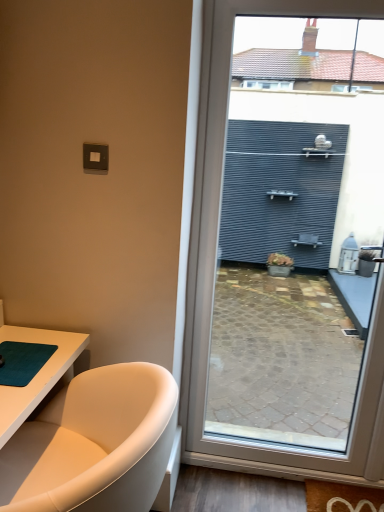
At what (x,y) coordinates should I click in order to perform the action: click on matte gray wall at right. Please return your answer as a coordinate pair (x, y). Image resolution: width=384 pixels, height=512 pixels. Looking at the image, I should click on (214, 272).

Which is in front, white leather bathtub at lower left or teal matte yoga mat at lower left?

white leather bathtub at lower left is closer to the camera.

Does white leather bathtub at lower left appear on the left side of teal matte yoga mat at lower left?

No.

Are white leather bathtub at lower left and teal matte yoga mat at lower left located far from each other?

No.

Can we say white leather bathtub at lower left lies outside teal matte yoga mat at lower left?

white leather bathtub at lower left lies outside teal matte yoga mat at lower left's area.

Based on the photo, does matte gray wall at right come behind teal matte yoga mat at lower left?

Yes, matte gray wall at right is further from the camera.

Is matte gray wall at right wider than teal matte yoga mat at lower left?

No, matte gray wall at right is not wider than teal matte yoga mat at lower left.

Based on their sizes in the image, would you say matte gray wall at right is bigger or smaller than teal matte yoga mat at lower left?

Considering their sizes, matte gray wall at right takes up more space than teal matte yoga mat at lower left.

In the scene shown: From the image's perspective, is teal matte yoga mat at lower left above white leather bathtub at lower left?

Yes, from the image's perspective, teal matte yoga mat at lower left is on top of white leather bathtub at lower left.

Is the surface of teal matte yoga mat at lower left in direct contact with white leather bathtub at lower left?

No, teal matte yoga mat at lower left is not in contact with white leather bathtub at lower left.

In terms of size, does teal matte yoga mat at lower left appear bigger or smaller than white leather bathtub at lower left?

teal matte yoga mat at lower left is smaller than white leather bathtub at lower left.

Can you tell me how much teal matte yoga mat at lower left and white leather bathtub at lower left differ in facing direction?

The angle between the facing direction of teal matte yoga mat at lower left and the facing direction of white leather bathtub at lower left is 176 degrees.

Is matte gray wall at right at the back of teal matte yoga mat at lower left?

No, matte gray wall at right is not at the back of teal matte yoga mat at lower left.

Do you think teal matte yoga mat at lower left is within matte gray wall at right, or outside of it?

teal matte yoga mat at lower left is spatially situated outside matte gray wall at right.

Considering the sizes of objects teal matte yoga mat at lower left and matte gray wall at right in the image provided, who is shorter, teal matte yoga mat at lower left or matte gray wall at right?

Standing shorter between the two is teal matte yoga mat at lower left.

Based on their sizes in the image, would you say teal matte yoga mat at lower left is bigger or smaller than matte gray wall at right?

In the image, teal matte yoga mat at lower left appears to be smaller than matte gray wall at right.

From the image's perspective, relative to matte gray wall at right, is white leather bathtub at lower left above or below?

Clearly, from the image's perspective, white leather bathtub at lower left is below matte gray wall at right.

Is white leather bathtub at lower left bigger than matte gray wall at right?

Indeed, white leather bathtub at lower left has a larger size compared to matte gray wall at right.

Which of these two, white leather bathtub at lower left or matte gray wall at right, stands taller?

With more height is matte gray wall at right.

Can you confirm if matte gray wall at right is wider than white leather bathtub at lower left?

Incorrect, the width of matte gray wall at right does not surpass that of white leather bathtub at lower left.

From a real-world perspective, is matte gray wall at right under white leather bathtub at lower left?

Actually, matte gray wall at right is physically above white leather bathtub at lower left in the real world.

Which is more to the right, matte gray wall at right or white leather bathtub at lower left?

matte gray wall at right is more to the right.

Find the location of a particular element. The width and height of the screenshot is (384, 512). yoga mat above the white leather bathtub at lower left (from the image's perspective) is located at coordinates (22, 361).

Locate an element on the screen. Image resolution: width=384 pixels, height=512 pixels. yoga mat that appears below the matte gray wall at right (from the image's perspective) is located at coordinates (22, 361).

When comparing their distances from matte gray wall at right, does teal matte yoga mat at lower left or white leather bathtub at lower left seem further?

teal matte yoga mat at lower left is further to matte gray wall at right.

From the image, which object appears to be farther from teal matte yoga mat at lower left, matte gray wall at right or white leather bathtub at lower left?

Based on the image, matte gray wall at right appears to be further to teal matte yoga mat at lower left.

Estimate the real-world distances between objects in this image. Which object is further from white leather bathtub at lower left, teal matte yoga mat at lower left or matte gray wall at right?

The object further to white leather bathtub at lower left is matte gray wall at right.

Considering their positions, is white leather bathtub at lower left positioned closer to teal matte yoga mat at lower left than matte gray wall at right?

Based on the image, white leather bathtub at lower left appears to be nearer to teal matte yoga mat at lower left.

Based on their spatial positions, is white leather bathtub at lower left or teal matte yoga mat at lower left further from matte gray wall at right?

teal matte yoga mat at lower left lies further to matte gray wall at right than the other object.

Which object lies nearer to the anchor point white leather bathtub at lower left, matte gray wall at right or teal matte yoga mat at lower left?

Among the two, teal matte yoga mat at lower left is located nearer to white leather bathtub at lower left.

Where is `bathtub situated between teal matte yoga mat at lower left and matte gray wall at right from left to right`? bathtub situated between teal matte yoga mat at lower left and matte gray wall at right from left to right is located at coordinates (94, 444).